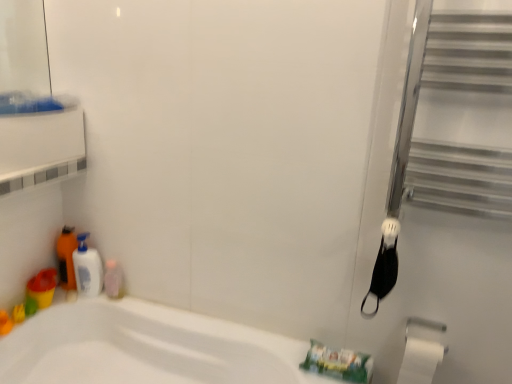
Question: From a real-world perspective, does translucent plastic cup at lower left stand above white matte toilet paper at lower right?

Choices:
 (A) no
 (B) yes

Answer: (B)

Question: Is translucent plastic cup at lower left shorter than white matte toilet paper at lower right?

Choices:
 (A) yes
 (B) no

Answer: (A)

Question: Is translucent plastic cup at lower left facing towards white matte toilet paper at lower right?

Choices:
 (A) yes
 (B) no

Answer: (A)

Question: Would you say translucent plastic cup at lower left is a long distance from white matte toilet paper at lower right?

Choices:
 (A) yes
 (B) no

Answer: (A)

Question: Is translucent plastic cup at lower left wider than white matte toilet paper at lower right?

Choices:
 (A) yes
 (B) no

Answer: (A)

Question: Is translucent plastic cup at lower left at the right side of white matte toilet paper at lower right?

Choices:
 (A) yes
 (B) no

Answer: (B)

Question: Considering the relative sizes of pink glossy bottle at lower left, which ranks as the 2th toiletry in left-to-right order, and silver metallic towel bar at lower right in the image provided, is pink glossy bottle at lower left, which ranks as the 2th toiletry in left-to-right order, taller than silver metallic towel bar at lower right?

Choices:
 (A) no
 (B) yes

Answer: (B)

Question: Is the depth of pink glossy bottle at lower left, which ranks as the 1th toiletry in right-to-left order, less than that of silver metallic towel bar at lower right?

Choices:
 (A) yes
 (B) no

Answer: (B)

Question: From a real-world perspective, is pink glossy bottle at lower left, which ranks as the 2th toiletry in left-to-right order, located beneath silver metallic towel bar at lower right?

Choices:
 (A) no
 (B) yes

Answer: (B)

Question: Is pink glossy bottle at lower left, which ranks as the 2th toiletry in left-to-right order, wider than silver metallic towel bar at lower right?

Choices:
 (A) no
 (B) yes

Answer: (A)

Question: Can you confirm if pink glossy bottle at lower left, which ranks as the 2th toiletry in left-to-right order, is shorter than silver metallic towel bar at lower right?

Choices:
 (A) yes
 (B) no

Answer: (B)

Question: Is pink glossy bottle at lower left, which ranks as the 2th toiletry in left-to-right order, not inside silver metallic towel bar at lower right?

Choices:
 (A) yes
 (B) no

Answer: (A)

Question: From the image's perspective, would you say translucent plastic bottle at lower left, placed as the 2th toiletry when sorted from right to left, is positioned over silver metallic towel bar at lower right?

Choices:
 (A) no
 (B) yes

Answer: (B)